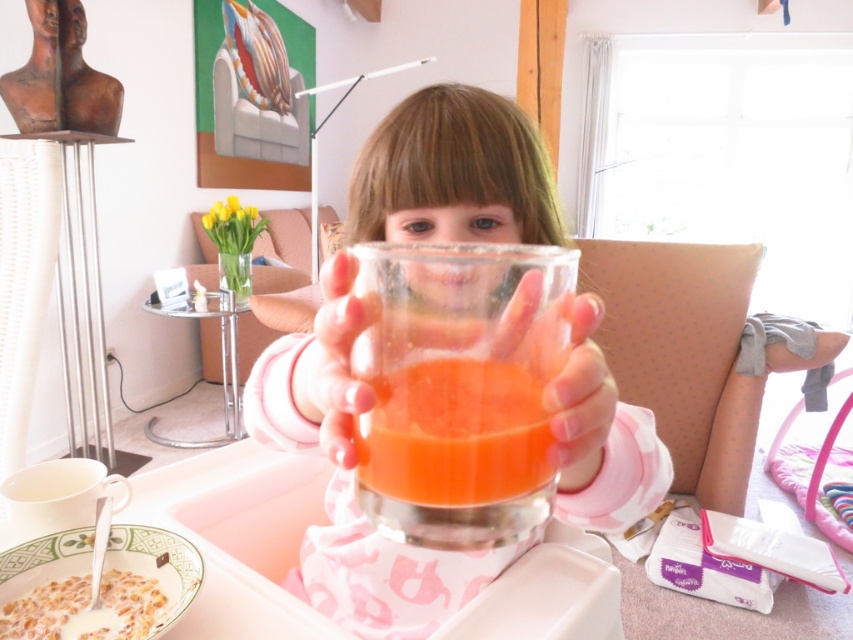
You are a parent trying to ensure your child drinks their juice. You see the translucent glass cup at center and the white creamy cereal at lower left. Which object is taller?

The translucent glass cup at center is taller than the white creamy cereal at lower left.

Looking at this image, you are a parent looking at the image of your child in the high chair. You see the translucent glass cup at center and the translucent glass juice at center. Which object is positioned higher?

The translucent glass cup at center is positioned higher than the translucent glass juice at center.